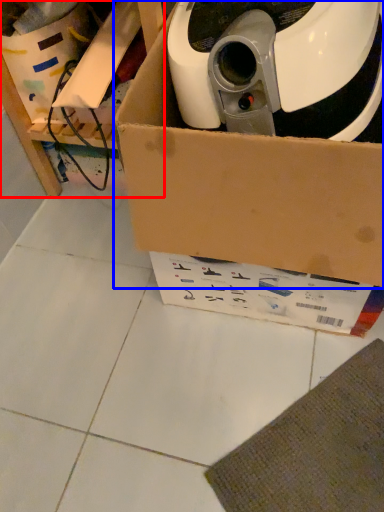
Question: Among these objects, which one is farthest to the camera, furniture (highlighted by a red box) or box (highlighted by a blue box)?

Choices:
 (A) furniture
 (B) box

Answer: (A)